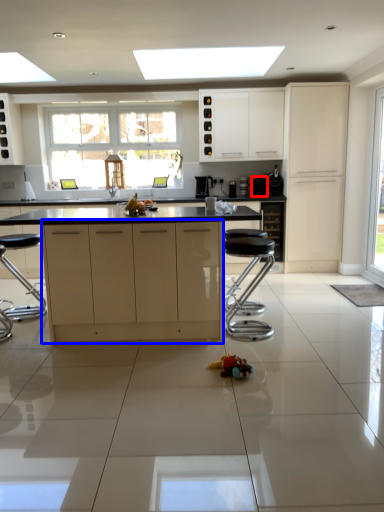
Question: Among these objects, which one is nearest to the camera, appliance (highlighted by a red box) or cabinetry (highlighted by a blue box)?

Choices:
 (A) appliance
 (B) cabinetry

Answer: (B)